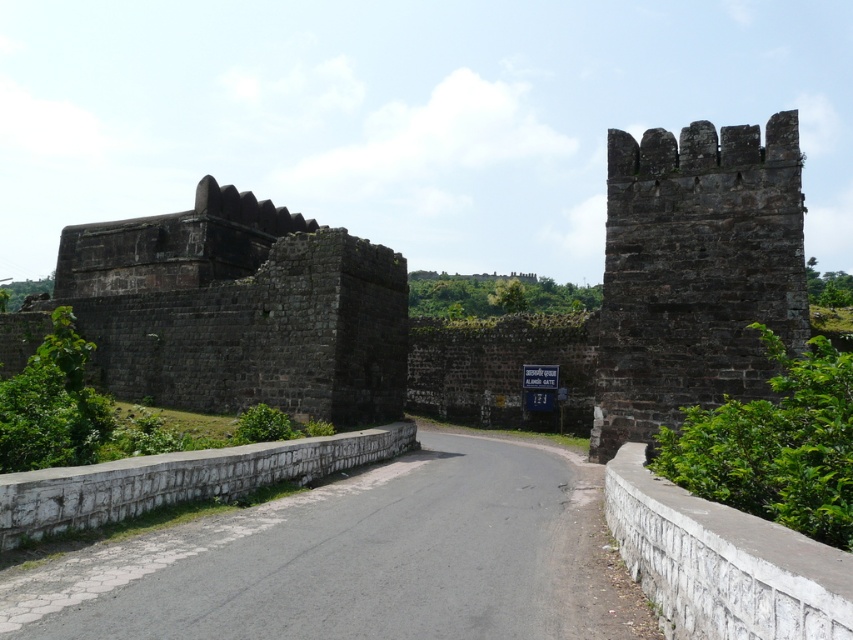
Can you confirm if white stone wall at right is wider than white stone wall at lower center?

Incorrect, white stone wall at right's width does not surpass white stone wall at lower center's.

Does white stone wall at right have a lesser width compared to white stone wall at lower center?

Correct, white stone wall at right's width is less than white stone wall at lower center's.

Does point (799, 550) come behind point (172, 477)?

No, (799, 550) is closer to viewer.

The image size is (853, 640). Identify the location of white stone wall at right. (722, 563).

Image resolution: width=853 pixels, height=640 pixels. In order to click on dark brown stone tower at right in this screenshot , I will do `click(695, 273)`.

Can you confirm if dark brown stone tower at right is thinner than white stone wall at lower center?

Yes, dark brown stone tower at right is thinner than white stone wall at lower center.

Where is `dark brown stone tower at right`? The width and height of the screenshot is (853, 640). dark brown stone tower at right is located at coordinates (695, 273).

Who is higher up, dark brown stone wall at left or white stone wall at lower center?

dark brown stone wall at left is higher up.

Does dark brown stone wall at left appear over white stone wall at lower center?

Correct, dark brown stone wall at left is located above white stone wall at lower center.

Between point (163, 266) and point (144, 474), which one is positioned in front?

Point (144, 474) is in front.

At what (x,y) coordinates should I click in order to perform the action: click on dark brown stone wall at left. Please return your answer as a coordinate pair (x, y). This screenshot has width=853, height=640. Looking at the image, I should click on (231, 310).